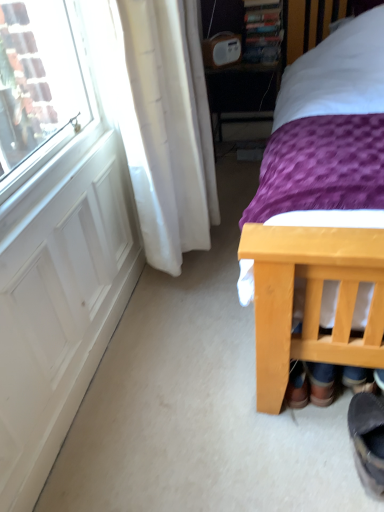
Question: Is dark grey suede boot at lower right positioned before white matte screen door at left?

Choices:
 (A) yes
 (B) no

Answer: (A)

Question: From a real-world perspective, is dark grey suede boot at lower right located higher than white matte screen door at left?

Choices:
 (A) no
 (B) yes

Answer: (A)

Question: Is dark grey suede boot at lower right shorter than white matte screen door at left?

Choices:
 (A) no
 (B) yes

Answer: (B)

Question: Can you confirm if dark grey suede boot at lower right is thinner than white matte screen door at left?

Choices:
 (A) no
 (B) yes

Answer: (A)

Question: Is dark grey suede boot at lower right not inside white matte screen door at left?

Choices:
 (A) no
 (B) yes

Answer: (B)

Question: Can you confirm if dark grey suede boot at lower right is positioned to the left of white matte screen door at left?

Choices:
 (A) yes
 (B) no

Answer: (B)

Question: Is purple fabric bed at right smaller than white matte screen door at left?

Choices:
 (A) no
 (B) yes

Answer: (A)

Question: Does purple fabric bed at right have a lesser width compared to white matte screen door at left?

Choices:
 (A) no
 (B) yes

Answer: (A)

Question: Is purple fabric bed at right oriented towards white matte screen door at left?

Choices:
 (A) yes
 (B) no

Answer: (B)

Question: Is purple fabric bed at right with white matte screen door at left?

Choices:
 (A) yes
 (B) no

Answer: (B)

Question: From a real-world perspective, is purple fabric bed at right on top of white matte screen door at left?

Choices:
 (A) yes
 (B) no

Answer: (A)

Question: Is purple fabric bed at right at the right side of white matte screen door at left?

Choices:
 (A) yes
 (B) no

Answer: (A)

Question: Is wooden table at center not within dark grey suede boot at lower right?

Choices:
 (A) no
 (B) yes

Answer: (B)